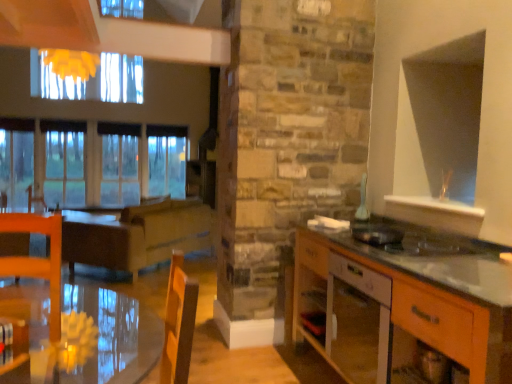
Question: Would you say brown wooden table at center is inside or outside wooden cabinet at right?

Choices:
 (A) outside
 (B) inside

Answer: (A)

Question: Does point (123, 264) appear closer or farther from the camera than point (374, 380)?

Choices:
 (A) closer
 (B) farther

Answer: (B)

Question: Based on their relative distances, which object is nearer to the wooden cabinet at right?

Choices:
 (A) transparent glass table at lower left
 (B) metallic silver toaster at right, acting as the second appliance starting from the top
 (C) brown leather armchair at left
 (D) white glossy vase at upper right, arranged as the second appliance when viewed from the front
 (E) brown wooden table at center

Answer: (B)

Question: Which object is positioned farthest from the white glossy vase at upper right, which is the 1th appliance from top to bottom?

Choices:
 (A) brown wooden table at center
 (B) transparent glass window at left
 (C) transparent glass table at lower left
 (D) metallic silver toaster at right, acting as the second appliance starting from the top
 (E) wooden cabinet at right

Answer: (B)